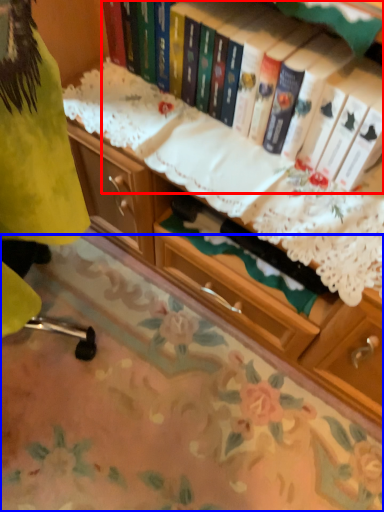
Question: Which of the following is the farthest to the observer, book (highlighted by a red box) or tablecloth (highlighted by a blue box)?

Choices:
 (A) book
 (B) tablecloth

Answer: (B)